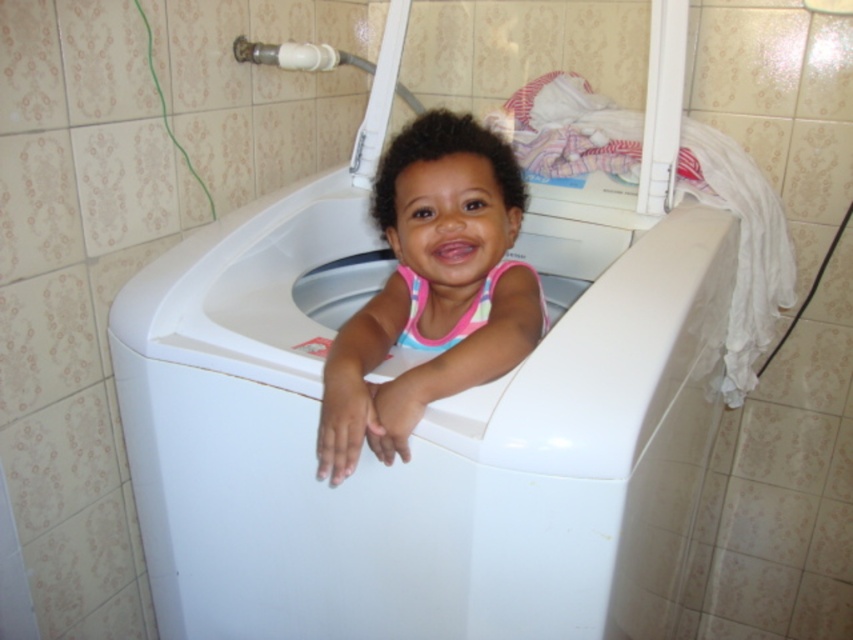
You are a parent trying to place a new bath toy in the bathroom. The toy requires a space of 6 inches between the white plastic bathtub at center and the pink fabric at center to be placed safely. Can you place the toy between them?

The distance between the white plastic bathtub at center and the pink fabric at center is 5.97 inches, which is slightly less than the required 6 inches. Therefore, the toy cannot be placed safely between them.

You are a parent trying to give your child a bath. You see the white plastic bathtub at center and the pink fabric at center in the bathroom. Which object should you place the child into for bathing?

You should place the child into the white plastic bathtub at center because it is designed for bathing, while the pink fabric at center is likely a towel or cloth and not meant for holding water or a child.